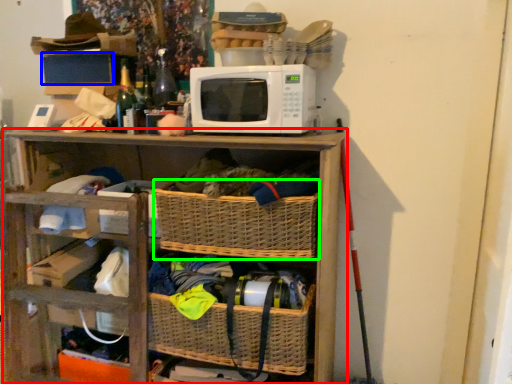
Question: Based on their relative distances, which object is nearer to shelf (highlighted by a red box)? Choose from storage box (highlighted by a blue box) and basket (highlighted by a green box).

Choices:
 (A) storage box
 (B) basket

Answer: (B)